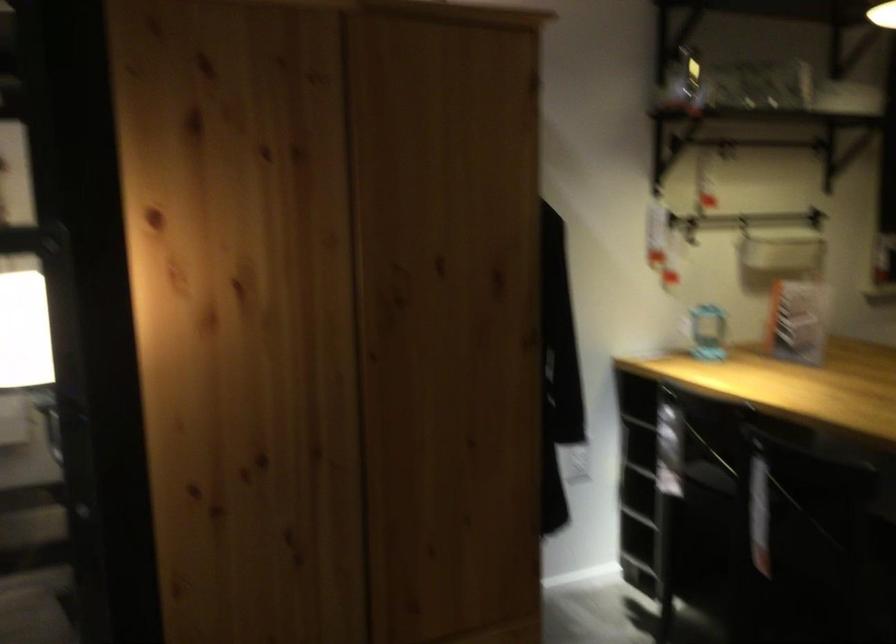
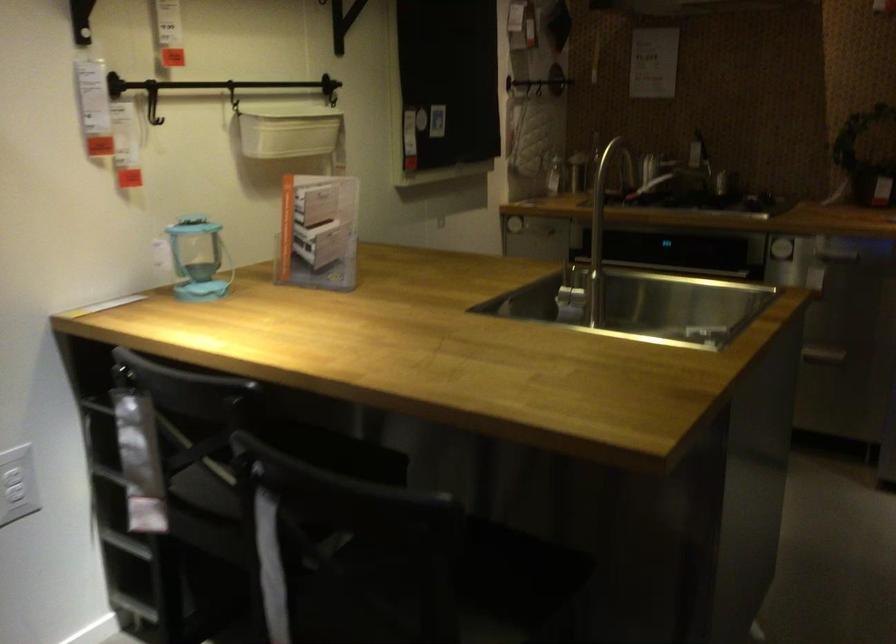
Find the pixel in the second image that matches [727,325] in the first image.

(197, 259)